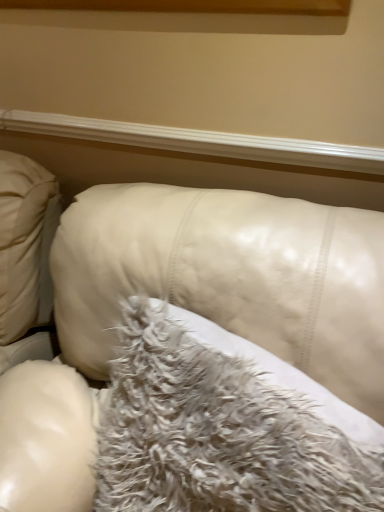
Question: Looking at their shapes, would you say white leather couch at center is wider or thinner than fuzzy white pillow at center?

Choices:
 (A) wide
 (B) thin

Answer: (A)

Question: From a real-world perspective, is white leather couch at center above or below fuzzy white pillow at center?

Choices:
 (A) above
 (B) below

Answer: (B)

Question: Considering the real-world distances, which object is farthest from the fuzzy white pillow at center?

Choices:
 (A) white leather couch at center
 (B) white glossy wood at upper center

Answer: (B)

Question: Estimate the real-world distances between objects in this image. Which object is farther from the white glossy wood at upper center?

Choices:
 (A) fuzzy white pillow at center
 (B) white leather couch at center

Answer: (A)